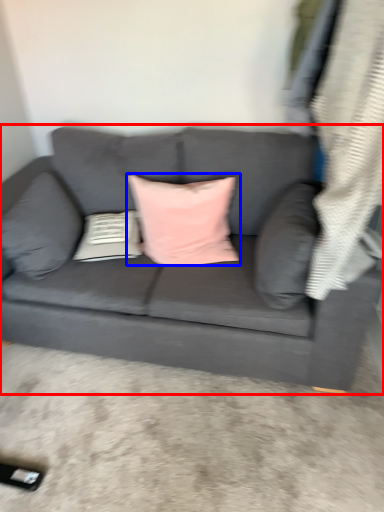
Question: Among these objects, which one is farthest to the camera, studio couch (highlighted by a red box) or pillow (highlighted by a blue box)?

Choices:
 (A) studio couch
 (B) pillow

Answer: (B)